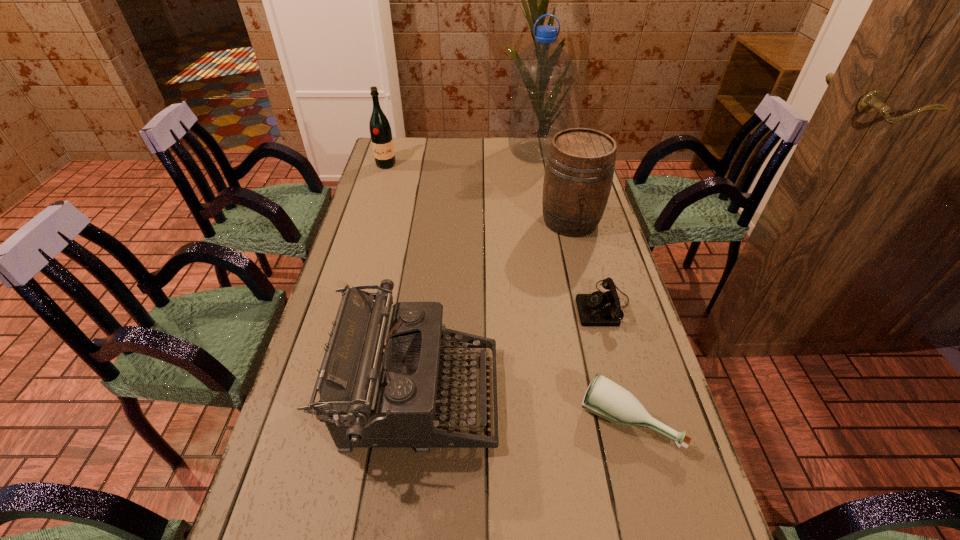
Find the location of a particular element. The image size is (960, 540). cider at the right edge is located at coordinates (580, 166).

Image resolution: width=960 pixels, height=540 pixels. What are the coordinates of `bottle present at the right edge` in the screenshot? It's located at (605, 398).

Where is `telephone that is at the right edge`? telephone that is at the right edge is located at coordinates (599, 308).

Where is `object located at the far left corner`? object located at the far left corner is located at coordinates (380, 131).

Locate an element on the screen. The width and height of the screenshot is (960, 540). object situated at the far right corner is located at coordinates [542, 75].

I want to click on free space at the far edge of the desktop, so click(x=454, y=144).

This screenshot has height=540, width=960. Find the location of `blank space at the left edge of the desktop`. blank space at the left edge of the desktop is located at coordinates (389, 262).

The image size is (960, 540). In the image, there is a desktop. Find the location of `vacant space at the right edge`. vacant space at the right edge is located at coordinates (659, 474).

Identify the location of vacant space that is in between the leftmost object and the water jug. Image resolution: width=960 pixels, height=540 pixels. (461, 159).

Where is `empty location between the cider and the leftmost object`? This screenshot has width=960, height=540. empty location between the cider and the leftmost object is located at coordinates (478, 193).